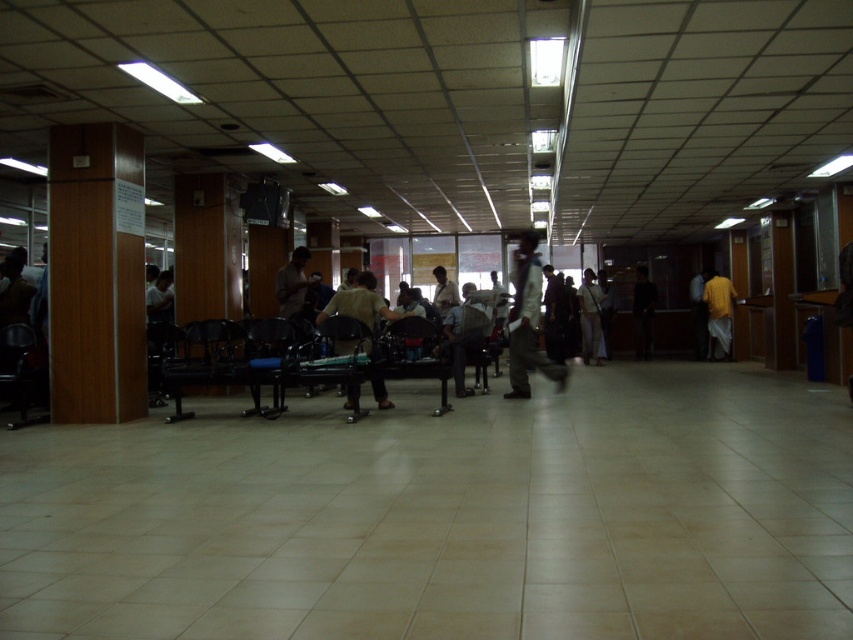
Does light brown fabric shirt at center appear on the left side of yellow matte shirt at right?

Indeed, light brown fabric shirt at center is positioned on the left side of yellow matte shirt at right.

Can you confirm if light brown fabric shirt at center is positioned above yellow matte shirt at right?

Yes, light brown fabric shirt at center is above yellow matte shirt at right.

The width and height of the screenshot is (853, 640). Describe the element at coordinates (361, 304) in the screenshot. I see `light brown fabric shirt at center` at that location.

The width and height of the screenshot is (853, 640). Find the location of `light brown fabric shirt at center`. light brown fabric shirt at center is located at coordinates (361, 304).

How far apart are white shirt at center and yellow matte shirt at right?

white shirt at center and yellow matte shirt at right are 5.55 meters apart.

Can you confirm if white shirt at center is positioned above yellow matte shirt at right?

No.

Between point (515, 316) and point (717, 285), which one is positioned behind?

The point (717, 285) is behind.

Locate an element on the screen. white shirt at center is located at coordinates (527, 321).

Which is below, wooden pillar at left or dark blue fabric pants at center?

dark blue fabric pants at center is lower down.

Who is more forward, (97, 170) or (561, 330)?

Point (97, 170)

Where is `wooden pillar at left`? wooden pillar at left is located at coordinates (96, 273).